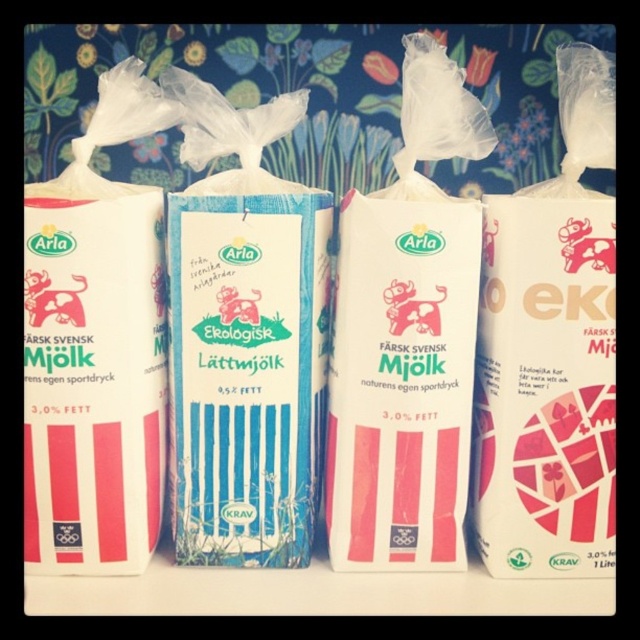
Is matte white milk carton at center bigger than matte white milk carton at left?

Yes.

Who is taller, matte white milk carton at center or matte white milk carton at left?

Standing taller between the two is matte white milk carton at center.

Does point (488, 122) come closer to viewer compared to point (118, 131)?

That is True.

Locate an element on the screen. The height and width of the screenshot is (640, 640). matte white milk carton at center is located at coordinates (406, 339).

Between matte white milk carton at left and pink paper carton at right, which one has less height?

matte white milk carton at left is shorter.

Where is `matte white milk carton at left`? Image resolution: width=640 pixels, height=640 pixels. matte white milk carton at left is located at coordinates coord(96,348).

Does blue striped carton at center appear under matte white milk carton at center?

Indeed, blue striped carton at center is positioned under matte white milk carton at center.

Is blue striped carton at center smaller than matte white milk carton at center?

Yes.

At what (x,y) coordinates should I click in order to perform the action: click on blue striped carton at center. Please return your answer as a coordinate pair (x, y). The height and width of the screenshot is (640, 640). Looking at the image, I should click on (243, 337).